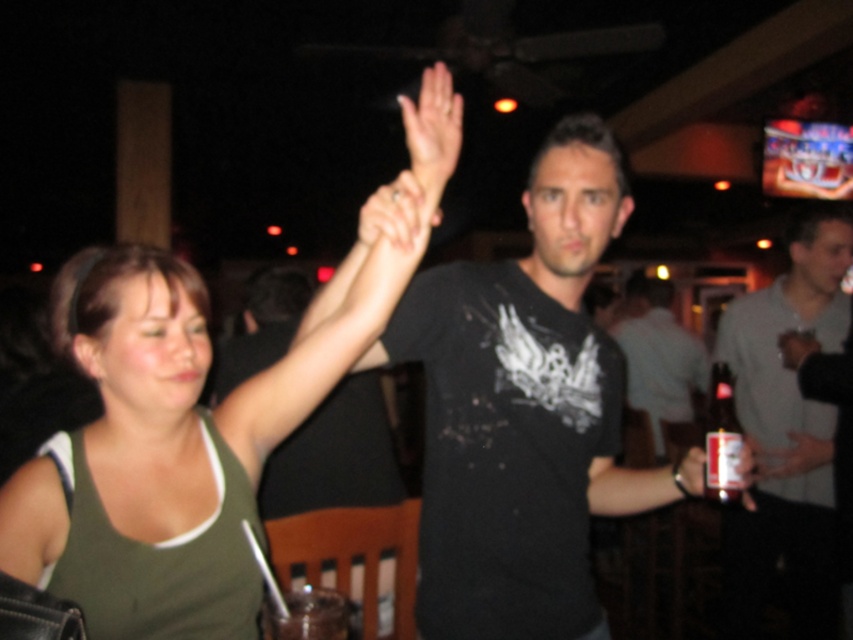
You are a bartender trying to place a clear glass bottle at right on a shelf next to the gray cotton shirt at right. The shelf has only 10 cm of space left. Can the bottle fit?

The gray cotton shirt at right is wider than the clear glass bottle at right. Since the shelf has 10 cm of space, the clear glass bottle at right may fit if its width is less than 10 cm. However, without knowing the exact width of the bottle, we cannot confirm for certain.